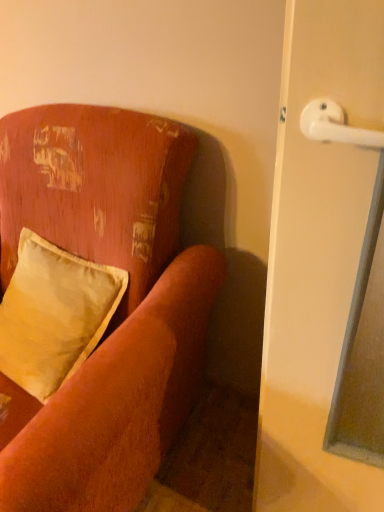
What do you see at coordinates (54, 314) in the screenshot? This screenshot has width=384, height=512. I see `satin yellow pillow at left` at bounding box center [54, 314].

Locate an element on the screen. satin yellow pillow at left is located at coordinates 54,314.

This screenshot has width=384, height=512. What do you see at coordinates (118, 307) in the screenshot?
I see `velvet-like orange couch at upper left` at bounding box center [118, 307].

I want to click on velvet-like orange couch at upper left, so click(118, 307).

The image size is (384, 512). Find the location of `satin yellow pillow at left`. satin yellow pillow at left is located at coordinates (54, 314).

Which is more to the left, velvet-like orange couch at upper left or satin yellow pillow at left?

Positioned to the left is velvet-like orange couch at upper left.

Is velvet-like orange couch at upper left closer to the viewer compared to satin yellow pillow at left?

Yes, it is.

Considering the positions of points (135, 349) and (22, 386), is point (135, 349) farther from camera compared to point (22, 386)?

No, it is in front of (22, 386).

From the image's perspective, which one is positioned higher, velvet-like orange couch at upper left or satin yellow pillow at left?

satin yellow pillow at left appears higher in the image.

From a real-world perspective, is velvet-like orange couch at upper left on top of satin yellow pillow at left?

No, from a real-world perspective, velvet-like orange couch at upper left is not above satin yellow pillow at left.

From the picture: Which object is wider, velvet-like orange couch at upper left or satin yellow pillow at left?

velvet-like orange couch at upper left is wider.

In terms of height, does velvet-like orange couch at upper left look taller or shorter compared to satin yellow pillow at left?

velvet-like orange couch at upper left is taller than satin yellow pillow at left.

Considering the relative sizes of velvet-like orange couch at upper left and satin yellow pillow at left in the image provided, is velvet-like orange couch at upper left bigger than satin yellow pillow at left?

Yes.

Is velvet-like orange couch at upper left located outside satin yellow pillow at left?

That's correct, velvet-like orange couch at upper left is outside of satin yellow pillow at left.

Is velvet-like orange couch at upper left beside satin yellow pillow at left?

No, velvet-like orange couch at upper left is not next to satin yellow pillow at left.

Is velvet-like orange couch at upper left aimed at satin yellow pillow at left?

Yes, velvet-like orange couch at upper left is turned towards satin yellow pillow at left.

What's the angular difference between velvet-like orange couch at upper left and satin yellow pillow at left's facing directions?

There is a 9.75-degree angle between the facing directions of velvet-like orange couch at upper left and satin yellow pillow at left.

You are a GUI agent. You are given a task and a screenshot of the screen. Output one action in this format:
    pyautogui.click(x=<x>, y=<y>)
    Task: Click on the pillow behind the velvet-like orange couch at upper left
    This screenshot has width=384, height=512.
    Given the screenshot: What is the action you would take?
    pyautogui.click(x=54, y=314)

In the image, is satin yellow pillow at left on the left side or the right side of velvet-like orange couch at upper left?

satin yellow pillow at left is to the right of velvet-like orange couch at upper left.

Between satin yellow pillow at left and velvet-like orange couch at upper left, which one is positioned behind?

satin yellow pillow at left.

Is point (2, 372) positioned behind point (21, 182)?

No, it is not.

From the image's perspective, is satin yellow pillow at left located above or below velvet-like orange couch at upper left?

Clearly, from the image's perspective, satin yellow pillow at left is above velvet-like orange couch at upper left.

From a real-world perspective, is satin yellow pillow at left physically above velvet-like orange couch at upper left?

Yes, from a real-world perspective, satin yellow pillow at left is over velvet-like orange couch at upper left

Considering the relative sizes of satin yellow pillow at left and velvet-like orange couch at upper left in the image provided, is satin yellow pillow at left thinner than velvet-like orange couch at upper left?

Yes, satin yellow pillow at left is thinner than velvet-like orange couch at upper left.

Considering the sizes of objects satin yellow pillow at left and velvet-like orange couch at upper left in the image provided, who is taller, satin yellow pillow at left or velvet-like orange couch at upper left?

With more height is velvet-like orange couch at upper left.

From the picture: Who is smaller, satin yellow pillow at left or velvet-like orange couch at upper left?

With smaller size is satin yellow pillow at left.

Is satin yellow pillow at left positioned beyond the bounds of velvet-like orange couch at upper left?

No, satin yellow pillow at left is inside or overlapping with velvet-like orange couch at upper left.

Does satin yellow pillow at left touch velvet-like orange couch at upper left?

No, satin yellow pillow at left is not with velvet-like orange couch at upper left.

Is satin yellow pillow at left positioned with its back to velvet-like orange couch at upper left?

Absolutely, satin yellow pillow at left is directed away from velvet-like orange couch at upper left.

Can you tell me how much satin yellow pillow at left and velvet-like orange couch at upper left differ in facing direction?

They differ by 9.75 degrees in their facing directions.

Image resolution: width=384 pixels, height=512 pixels. I want to click on studio couch in front of the satin yellow pillow at left, so click(118, 307).

What are the coordinates of `pillow above the velvet-like orange couch at upper left (from the image's perspective)` in the screenshot? It's located at (54, 314).

This screenshot has width=384, height=512. I want to click on studio couch below the satin yellow pillow at left (from the image's perspective), so click(x=118, y=307).